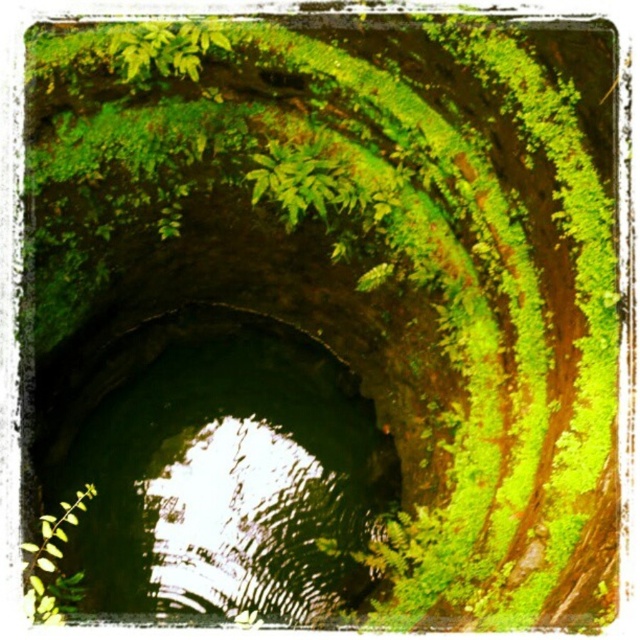
Between green mossy hole at center and green leafy plant at lower left, which one appears on the right side from the viewer's perspective?

green mossy hole at center is more to the right.

Does green mossy hole at center appear over green leafy plant at lower left?

Indeed, green mossy hole at center is positioned over green leafy plant at lower left.

Describe the element at coordinates (220, 470) in the screenshot. This screenshot has width=640, height=640. I see `green mossy hole at center` at that location.

Where is `green mossy hole at center`? green mossy hole at center is located at coordinates (220, 470).